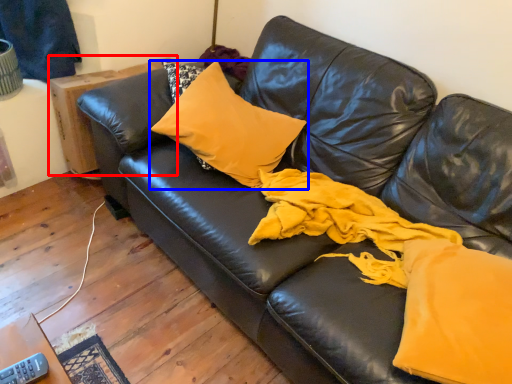
Question: Which object is further to the camera taking this photo, table (highlighted by a red box) or pillow (highlighted by a blue box)?

Choices:
 (A) table
 (B) pillow

Answer: (A)